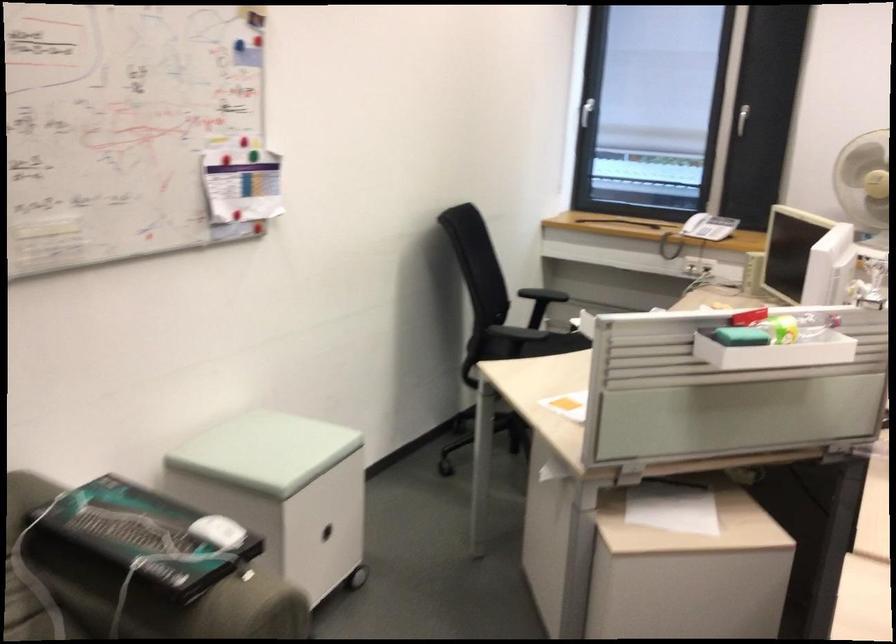
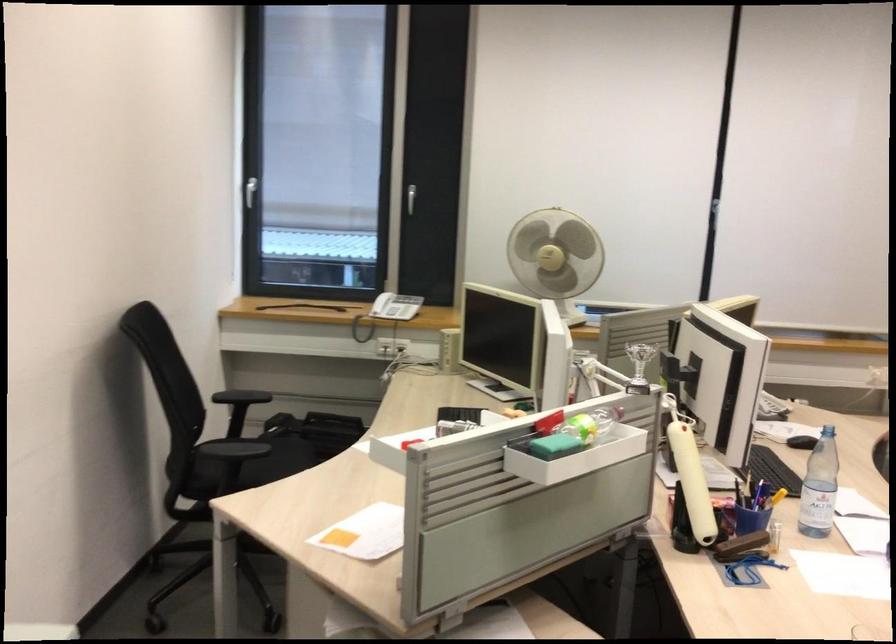
Locate, in the second image, the point that corresponds to point 714,234 in the first image.

(386, 312)